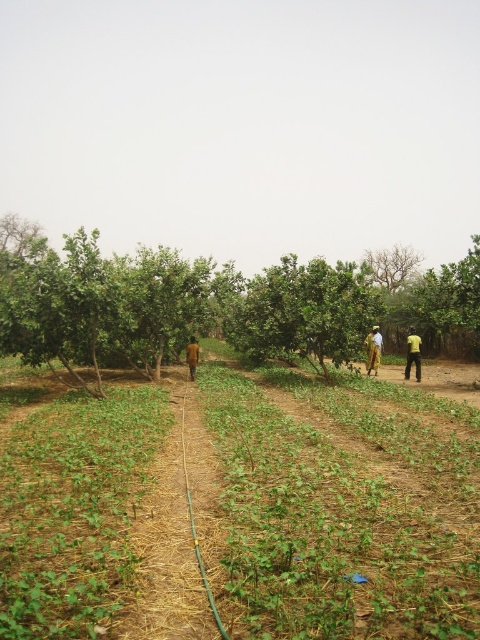
You are standing at the point marked as point (412, 353) and you see yellow fabric at right. What is the direction of the yellow fabric relative to your current position?

The yellow fabric at right is located to the right of point (412, 353).

You are standing at the origin point of the coordinate system in this image. You want to water the green leafy tree at center using a hose located at the lower part of the image. In which direction should you move to reach the tree from the origin?

The green leafy tree at center is located at coordinates point (303,312), so you should move upwards and to the right from the origin to reach it.